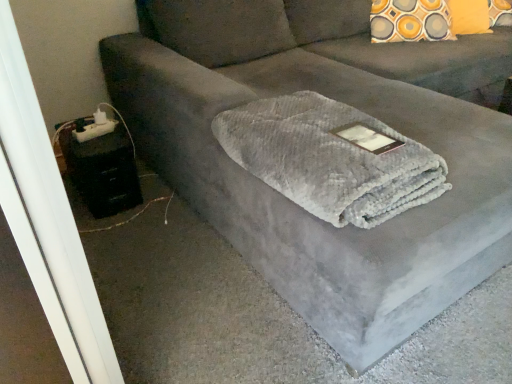
Where is `blank space above black plastic table at lower left (from a real-world perspective)`? The width and height of the screenshot is (512, 384). blank space above black plastic table at lower left (from a real-world perspective) is located at coordinates (86, 129).